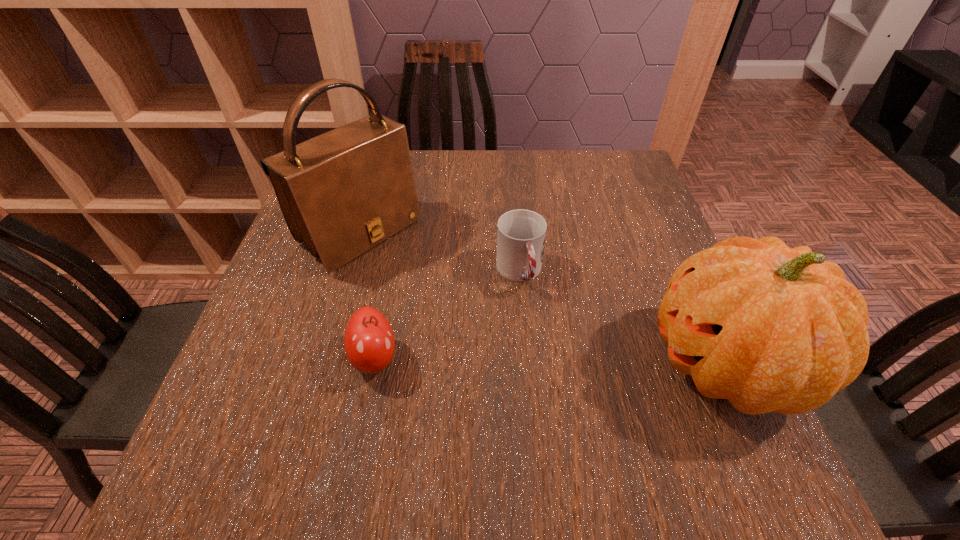
This screenshot has height=540, width=960. Identify the location of object that is at the far left corner. (343, 192).

The width and height of the screenshot is (960, 540). What are the coordinates of `object present at the near right corner` in the screenshot? It's located at (772, 329).

I want to click on vacant space at the far edge of the desktop, so click(554, 154).

The width and height of the screenshot is (960, 540). In the image, there is a desktop. Find the location of `vacant space at the near edge`. vacant space at the near edge is located at coordinates [350, 401].

The width and height of the screenshot is (960, 540). Find the location of `vacant space at the right edge of the desktop`. vacant space at the right edge of the desktop is located at coordinates (631, 263).

In the image, there is a desktop. Where is `free region at the far right corner`? free region at the far right corner is located at coordinates (588, 165).

The height and width of the screenshot is (540, 960). What are the coordinates of `vacant area between the apple and the cup` in the screenshot? It's located at (447, 315).

Where is `vacant point located between the third object from left to right and the shoulder bag`? The image size is (960, 540). vacant point located between the third object from left to right and the shoulder bag is located at coordinates (440, 253).

Locate an element on the screen. This screenshot has width=960, height=540. free spot between the apple and the second tallest object is located at coordinates (550, 361).

At what (x,y) coordinates should I click in order to perform the action: click on vacant area between the apple and the second tallest object. Please return your answer as a coordinate pair (x, y). Image resolution: width=960 pixels, height=540 pixels. Looking at the image, I should click on (x=550, y=361).